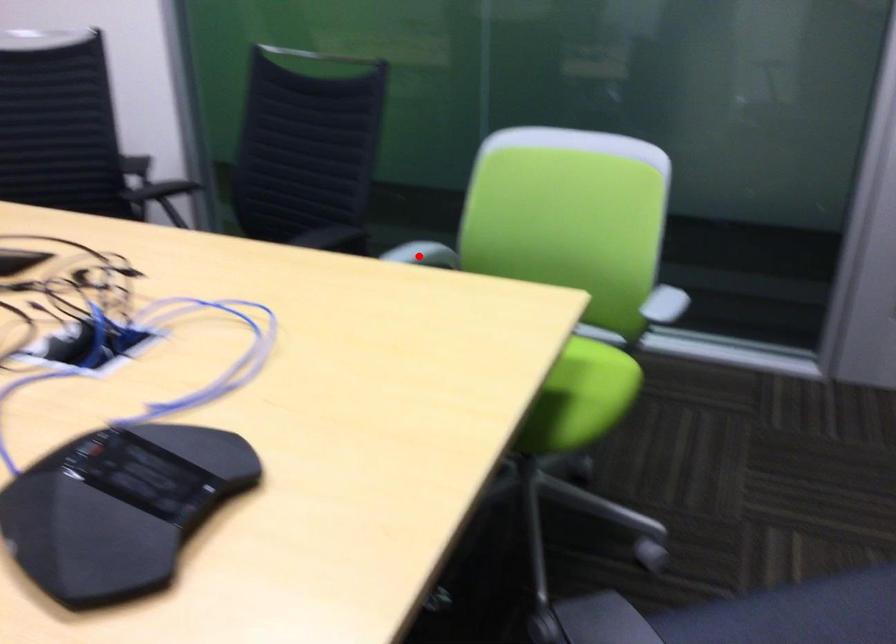
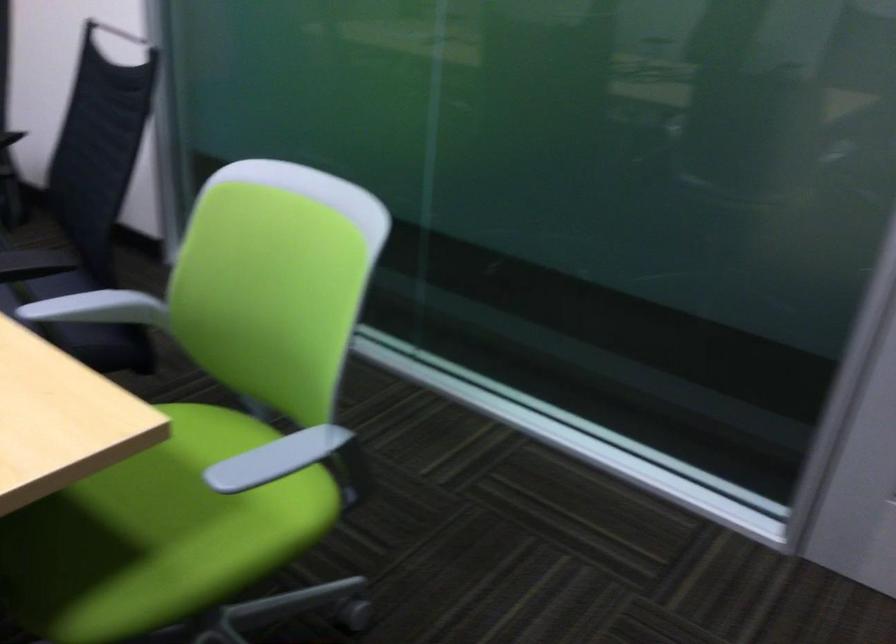
Find the pixel in the second image that matches the highlighted location in the first image.

(97, 308)